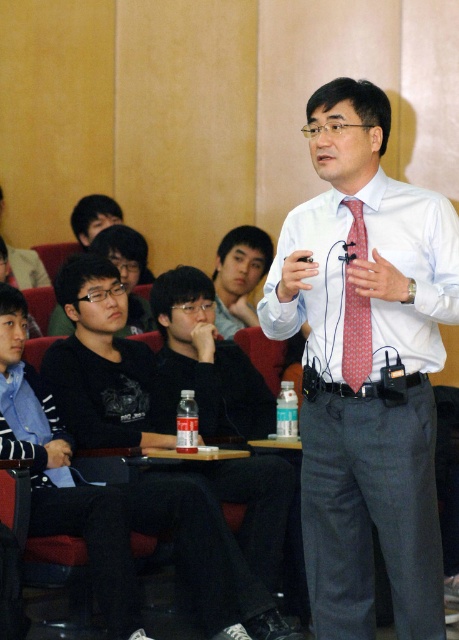
You are sitting in the front row of the audience and want to see both the white shirt at center and the black matte shirt at left clearly. Which one will appear larger to you?

The white shirt at center will appear larger because it is much taller than the black matte shirt at left.

You are organizing a photo shoot and need to place two shirts in a display case. The display case has limited space. Which shirt, the white shirt at center or the black matte shirt at left, would you choose to place first to ensure both fit?

The white shirt at center occupies less space than the black matte shirt at left, so you should place the white shirt at center first to ensure both fit in the display case.

You are an event coordinator who needs to adjust the seating arrangement for a photo shoot. The photographer mentioned that the subject wearing the matte black shirt at center and the person with the red dotted tie at center should be positioned so that their heights are balanced in the frame. Which object should be raised to achieve this?

The red dotted tie at center should be raised because the matte black shirt at center is much taller than the red dotted tie at center, so lifting the red dotted tie at center would balance their heights in the frame.